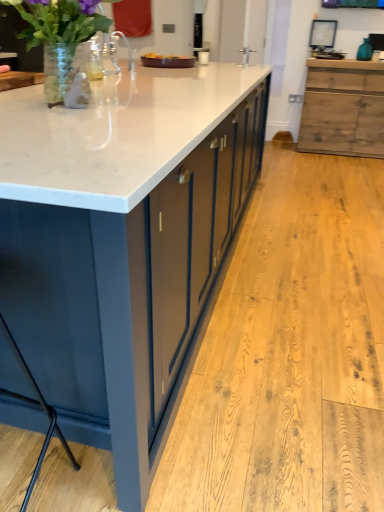
Question: Considering the relative sizes of matte dark blue bar stool at lower left and white marble countertop at center in the image provided, is matte dark blue bar stool at lower left bigger than white marble countertop at center?

Choices:
 (A) yes
 (B) no

Answer: (B)

Question: Can you confirm if matte dark blue bar stool at lower left is shorter than white marble countertop at center?

Choices:
 (A) no
 (B) yes

Answer: (B)

Question: Is matte dark blue bar stool at lower left smaller than white marble countertop at center?

Choices:
 (A) yes
 (B) no

Answer: (A)

Question: Is matte dark blue bar stool at lower left facing towards white marble countertop at center?

Choices:
 (A) no
 (B) yes

Answer: (B)

Question: Is matte dark blue bar stool at lower left oriented away from white marble countertop at center?

Choices:
 (A) no
 (B) yes

Answer: (A)

Question: Is matte dark blue bar stool at lower left far away from white marble countertop at center?

Choices:
 (A) no
 (B) yes

Answer: (A)

Question: Does clear glass vase at upper left have a greater height compared to white marble countertop at center?

Choices:
 (A) no
 (B) yes

Answer: (A)

Question: Would you consider clear glass vase at upper left to be distant from white marble countertop at center?

Choices:
 (A) yes
 (B) no

Answer: (B)

Question: From a real-world perspective, is clear glass vase at upper left beneath white marble countertop at center?

Choices:
 (A) yes
 (B) no

Answer: (B)

Question: From a real-world perspective, is clear glass vase at upper left located higher than white marble countertop at center?

Choices:
 (A) no
 (B) yes

Answer: (B)

Question: Considering the relative sizes of clear glass vase at upper left and white marble countertop at center in the image provided, is clear glass vase at upper left bigger than white marble countertop at center?

Choices:
 (A) yes
 (B) no

Answer: (B)

Question: Is clear glass vase at upper left placed right next to white marble countertop at center?

Choices:
 (A) yes
 (B) no

Answer: (B)

Question: Is white marble countertop at center to the left of clear glass vase at upper left from the viewer's perspective?

Choices:
 (A) no
 (B) yes

Answer: (A)